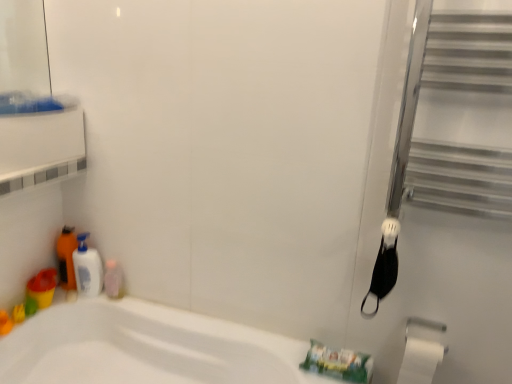
Identify the location of white glossy bottle at left. This screenshot has height=384, width=512. (87, 268).

What do you see at coordinates (420, 361) in the screenshot?
I see `white matte toilet paper at lower right` at bounding box center [420, 361].

Image resolution: width=512 pixels, height=384 pixels. In order to click on translucent plastic bottle at lower left, marked as the first toiletry in a left-to-right arrangement in this screenshot , I will do `click(66, 257)`.

This screenshot has width=512, height=384. I want to click on white glossy bottle at left, so click(x=87, y=268).

Can you confirm if translucent plastic bottle at lower left, placed as the 2th toiletry when sorted from right to left, is taller than black matte screen door at right?

Incorrect, the height of translucent plastic bottle at lower left, placed as the 2th toiletry when sorted from right to left, is not larger of that of black matte screen door at right.

Between translucent plastic bottle at lower left, marked as the first toiletry in a left-to-right arrangement, and black matte screen door at right, which one appears on the left side from the viewer's perspective?

Positioned to the left is translucent plastic bottle at lower left, marked as the first toiletry in a left-to-right arrangement.

Considering the sizes of objects translucent plastic bottle at lower left, marked as the first toiletry in a left-to-right arrangement, and black matte screen door at right in the image provided, who is smaller, translucent plastic bottle at lower left, marked as the first toiletry in a left-to-right arrangement, or black matte screen door at right?

With smaller size is translucent plastic bottle at lower left, marked as the first toiletry in a left-to-right arrangement.

This screenshot has height=384, width=512. Find the location of `the 2nd toiletry counting from the left of the black matte screen door at right`. the 2nd toiletry counting from the left of the black matte screen door at right is located at coordinates (66, 257).

Is translucent plastic bottle at lower left, placed as the 2th toiletry when sorted from right to left, oriented towards white glossy bottle at left?

Yes, translucent plastic bottle at lower left, placed as the 2th toiletry when sorted from right to left, is turned towards white glossy bottle at left.

Consider the image. From the image's perspective, is translucent plastic bottle at lower left, placed as the 2th toiletry when sorted from right to left, above or below white glossy bottle at left?

translucent plastic bottle at lower left, placed as the 2th toiletry when sorted from right to left, is above white glossy bottle at left.

Is silver metallic towel bar at lower right to the right of pink glossy bottle at lower left, which ranks as the 2th toiletry in left-to-right order, from the viewer's perspective?

Yes, silver metallic towel bar at lower right is to the right of pink glossy bottle at lower left, which ranks as the 2th toiletry in left-to-right order.

Based on the photo, can you confirm if silver metallic towel bar at lower right is smaller than pink glossy bottle at lower left, which ranks as the 1th toiletry in right-to-left order?

Yes.

Considering the sizes of silver metallic towel bar at lower right and pink glossy bottle at lower left, which ranks as the 1th toiletry in right-to-left order, in the image, is silver metallic towel bar at lower right taller or shorter than pink glossy bottle at lower left, which ranks as the 1th toiletry in right-to-left order,?

silver metallic towel bar at lower right is shorter than pink glossy bottle at lower left, which ranks as the 1th toiletry in right-to-left order.

Based on the photo, who is taller, white matte toilet paper at lower right or translucent plastic bottle at lower left, placed as the 2th toiletry when sorted from right to left?

With more height is white matte toilet paper at lower right.

From a real-world perspective, who is located higher, white matte toilet paper at lower right or translucent plastic bottle at lower left, marked as the first toiletry in a left-to-right arrangement?

translucent plastic bottle at lower left, marked as the first toiletry in a left-to-right arrangement.

Is white matte toilet paper at lower right bigger or smaller than translucent plastic bottle at lower left, marked as the first toiletry in a left-to-right arrangement?

In the image, white matte toilet paper at lower right appears to be larger than translucent plastic bottle at lower left, marked as the first toiletry in a left-to-right arrangement.

Can you confirm if white glossy bottle at left is taller than translucent plastic cup at lower left?

Indeed, white glossy bottle at left has a greater height compared to translucent plastic cup at lower left.

Considering the positions of point (94, 279) and point (27, 315), is point (94, 279) closer or farther from the camera than point (27, 315)?

Clearly, point (94, 279) is more distant from the camera than point (27, 315).

Is white glossy bottle at left oriented away from translucent plastic cup at lower left?

No.

Considering the relative positions of white glossy bottle at left and translucent plastic cup at lower left in the image provided, is white glossy bottle at left in front of translucent plastic cup at lower left?

No, white glossy bottle at left is further to the viewer.

Is silver metallic towel bar at lower right oriented towards white matte toilet paper at lower right?

Yes, silver metallic towel bar at lower right is aimed at white matte toilet paper at lower right.

In the scene shown: Is silver metallic towel bar at lower right wider than white matte toilet paper at lower right?

Yes, silver metallic towel bar at lower right is wider than white matte toilet paper at lower right.

Is silver metallic towel bar at lower right in contact with white matte toilet paper at lower right?

Yes, silver metallic towel bar at lower right is next to white matte toilet paper at lower right.

Does point (433, 328) appear closer or farther from the camera than point (404, 364)?

Point (433, 328) is farther from the camera than point (404, 364).

Based on their sizes in the image, would you say translucent plastic cup at lower left is bigger or smaller than white glossy bottle at left?

In the image, translucent plastic cup at lower left appears to be smaller than white glossy bottle at left.

In the scene shown: Measure the distance between translucent plastic cup at lower left and white glossy bottle at left.

They are 6.20 inches apart.

Consider the image. Which object is positioned more to the left, translucent plastic cup at lower left or white glossy bottle at left?

translucent plastic cup at lower left is more to the left.

Is translucent plastic cup at lower left in front of white glossy bottle at left?

That is True.

The width and height of the screenshot is (512, 384). In order to click on screen door above the translucent plastic bottle at lower left, placed as the 2th toiletry when sorted from right to left (from a real-world perspective) in this screenshot , I will do click(442, 190).

Find the location of `cleaning product below the translucent plastic bottle at lower left, marked as the first toiletry in a left-to-right arrangement (from the image's perspective)`. cleaning product below the translucent plastic bottle at lower left, marked as the first toiletry in a left-to-right arrangement (from the image's perspective) is located at coordinates (87, 268).

Estimate the real-world distances between objects in this image. Which object is further from white matte toilet paper at lower right, white glossy bottle at left or black matte screen door at right?

The object further to white matte toilet paper at lower right is white glossy bottle at left.

Based on their spatial positions, is silver metallic towel bar at lower right or white glossy bottle at left further from translucent plastic cup at lower left?

silver metallic towel bar at lower right lies further to translucent plastic cup at lower left than the other object.

Which object lies nearer to the anchor point translucent plastic cup at lower left, white matte toilet paper at lower right or white glossy bottle at left?

The object closer to translucent plastic cup at lower left is white glossy bottle at left.

Looking at the image, which one is located further to silver metallic towel bar at lower right, translucent plastic cup at lower left or translucent plastic bottle at lower left, placed as the 2th toiletry when sorted from right to left?

Among the two, translucent plastic cup at lower left is located further to silver metallic towel bar at lower right.

When comparing their distances from white glossy bottle at left, does black matte screen door at right or translucent plastic bottle at lower left, placed as the 2th toiletry when sorted from right to left, seem closer?

Among the two, translucent plastic bottle at lower left, placed as the 2th toiletry when sorted from right to left, is located nearer to white glossy bottle at left.

Looking at the image, which one is located closer to white glossy bottle at left, silver metallic towel bar at lower right or translucent plastic bottle at lower left, placed as the 2th toiletry when sorted from right to left?

translucent plastic bottle at lower left, placed as the 2th toiletry when sorted from right to left.

Estimate the real-world distances between objects in this image. Which object is further from translucent plastic bottle at lower left, marked as the first toiletry in a left-to-right arrangement, silver metallic towel bar at lower right or white glossy bottle at left?

silver metallic towel bar at lower right lies further to translucent plastic bottle at lower left, marked as the first toiletry in a left-to-right arrangement, than the other object.

Looking at the image, which one is located further to black matte screen door at right, white matte toilet paper at lower right or translucent plastic bottle at lower left, marked as the first toiletry in a left-to-right arrangement?

translucent plastic bottle at lower left, marked as the first toiletry in a left-to-right arrangement, is further to black matte screen door at right.

Locate an element on the screen. Image resolution: width=512 pixels, height=384 pixels. toiletry located between translucent plastic cup at lower left and white glossy bottle at left in the left-right direction is located at coordinates (66, 257).

This screenshot has width=512, height=384. Identify the location of towel bar between white glossy bottle at left and black matte screen door at right from left to right. (424, 324).

This screenshot has width=512, height=384. Identify the location of cleaning product between translucent plastic cup at lower left and black matte screen door at right in the horizontal direction. pos(87,268).

Identify the location of toilet paper between pink glossy bottle at lower left, which ranks as the 1th toiletry in right-to-left order, and black matte screen door at right. (420, 361).